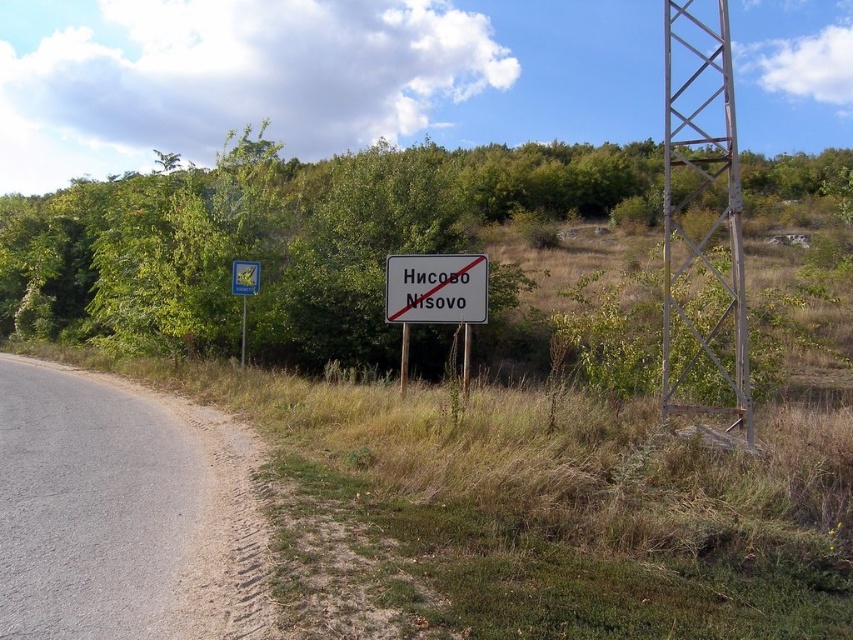
Which is more to the right, green leafy tree at center or metallic reflective sign at left?

green leafy tree at center is more to the right.

Is green leafy tree at center to the left of metallic reflective sign at left from the viewer's perspective?

No, green leafy tree at center is not to the left of metallic reflective sign at left.

Who is more forward, (654, 166) or (245, 305)?

Point (245, 305)

I want to click on green leafy tree at center, so click(x=283, y=241).

Can you confirm if green leafy tree at center is shorter than gray metallic sign at center?

No, green leafy tree at center is not shorter than gray metallic sign at center.

Image resolution: width=853 pixels, height=640 pixels. Identify the location of green leafy tree at center. (283, 241).

Locate an element on the screen. green leafy tree at center is located at coordinates [x=283, y=241].

Is point (699, 397) behind point (244, 364)?

No, it is not.

Which is above, metallic tower at right or brushed metal sign at left?

metallic tower at right is above.

What do you see at coordinates (701, 221) in the screenshot? The height and width of the screenshot is (640, 853). I see `metallic tower at right` at bounding box center [701, 221].

I want to click on metallic tower at right, so click(701, 221).